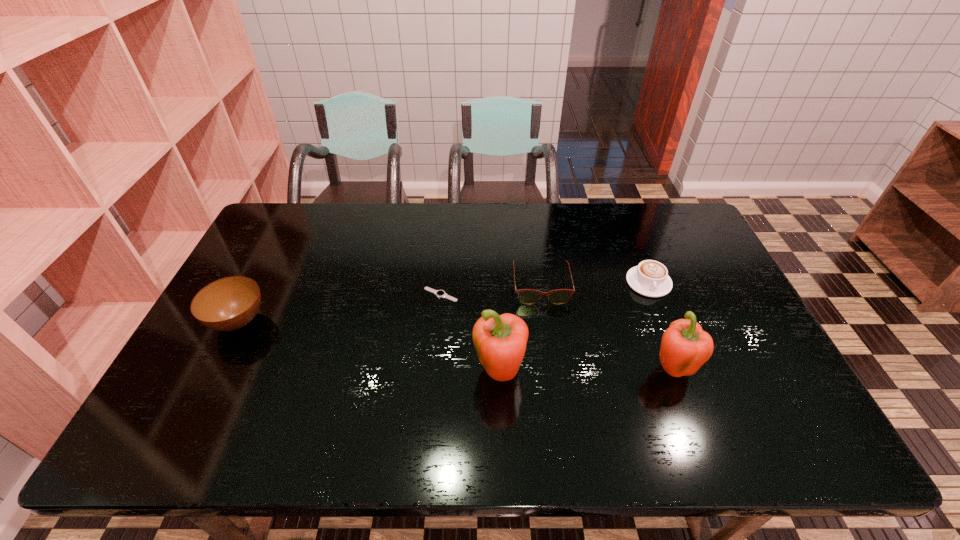
In the image, there is a desktop. Where is `blank space at the right edge`? blank space at the right edge is located at coordinates (730, 312).

Find the location of `free space between the cappuccino and the second tallest object`. free space between the cappuccino and the second tallest object is located at coordinates (660, 326).

In order to click on unoccupied position between the right pepper and the spectacles in this screenshot , I will do `click(607, 328)`.

In order to click on free space between the second tallest object and the watch in this screenshot , I will do [556, 332].

This screenshot has height=540, width=960. What are the coordinates of `vacant space in between the shorter pepper and the watch` in the screenshot? It's located at (556, 332).

Image resolution: width=960 pixels, height=540 pixels. In order to click on vacant area that lies between the right pepper and the left pepper in this screenshot , I will do click(586, 372).

I want to click on vacant area that lies between the spectacles and the shorter pepper, so click(x=607, y=328).

The image size is (960, 540). Find the location of `free space between the cappuccino and the spectacles`. free space between the cappuccino and the spectacles is located at coordinates (594, 285).

In order to click on free space between the spectacles and the fourth shortest object in this screenshot , I will do `click(390, 304)`.

Identify the location of vacant area that lies between the spectacles and the fifth object from right to left. The image size is (960, 540). (491, 291).